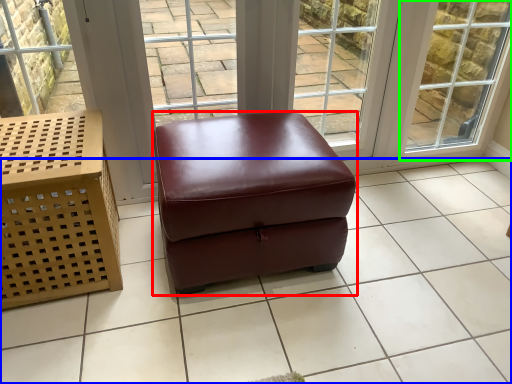
Question: Based on their relative distances, which object is nearer to stool (highlighted by a red box)? Choose from tile (highlighted by a blue box) and window (highlighted by a green box).

Choices:
 (A) tile
 (B) window

Answer: (A)